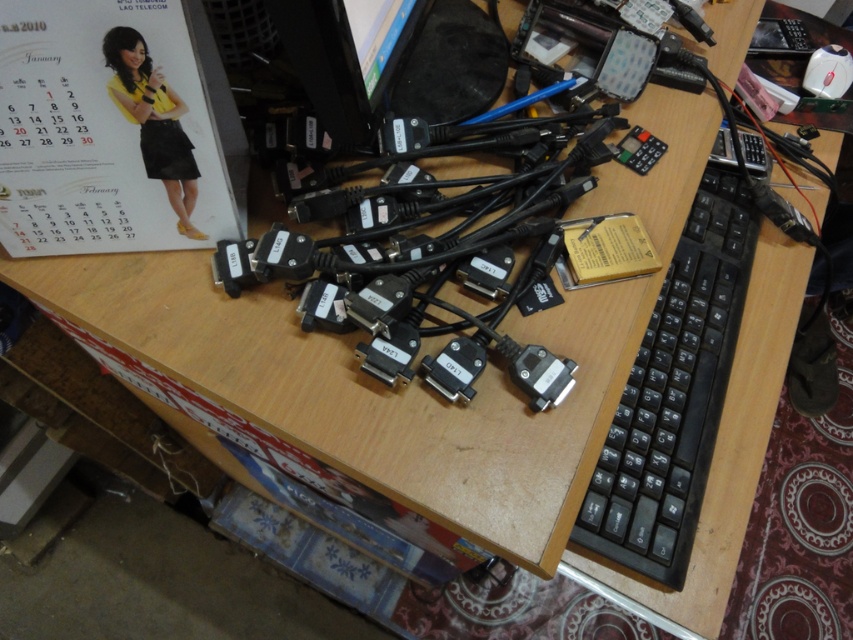
Can you confirm if matte paper calendar at upper left is thinner than black plastic monitor at upper center?

In fact, matte paper calendar at upper left might be wider than black plastic monitor at upper center.

Does matte paper calendar at upper left have a smaller size compared to black plastic monitor at upper center?

Actually, matte paper calendar at upper left might be larger than black plastic monitor at upper center.

Describe the element at coordinates (114, 129) in the screenshot. I see `matte paper calendar at upper left` at that location.

This screenshot has height=640, width=853. Find the location of `matte paper calendar at upper left`. matte paper calendar at upper left is located at coordinates tap(114, 129).

Can you confirm if matte paper calendar at upper left is wider than black plastic keyboard at right?

No.

Which is in front, point (132, 228) or point (700, 492)?

Positioned in front is point (132, 228).

Is point (132, 109) in front of point (624, 486)?

Yes, point (132, 109) is closer to viewer.

Image resolution: width=853 pixels, height=640 pixels. In order to click on matte paper calendar at upper left in this screenshot , I will do `click(114, 129)`.

Which is above, black plastic keyboard at right or black plastic monitor at upper center?

black plastic monitor at upper center is above.

Is point (651, 404) positioned before point (364, 45)?

No, (651, 404) is further to viewer.

Identify the location of black plastic keyboard at right. (672, 394).